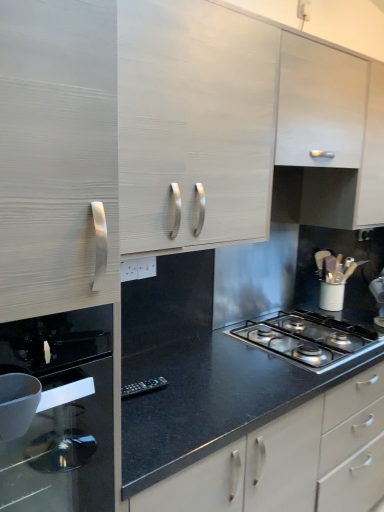
Where is `vacant location below matte white cabinet at upper left, which ranks as the first cabinetry in left-to-right order (from a real-world perspective)`? vacant location below matte white cabinet at upper left, which ranks as the first cabinetry in left-to-right order (from a real-world perspective) is located at coordinates (187, 365).